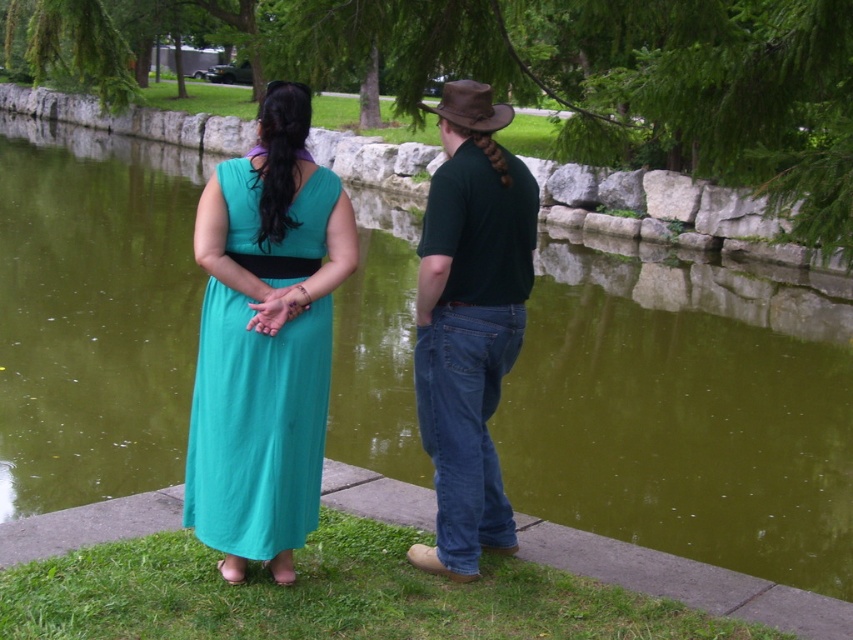
You are a photographer positioned at point (469, 323) in the image. You see the dark green cotton shirt at center. What object is located exactly at your current position?

The dark green cotton shirt at center is located exactly at point (469, 323).

You are a photographer trying to capture a clear shot of the teal fabric dress at center and the brown leather cowboy hat at upper center. Which object is closer to the camera?

A: The teal fabric dress at center is closer to the camera since it is in front of the brown leather cowboy hat at upper center.

You are a photographer trying to capture both the matte green dress at center and the dark green cotton shirt at center in a single frame. Since the camera can only focus on objects of a certain height, which one should you prioritize to ensure it is in focus?

The dark green cotton shirt at center has a greater height compared to the matte green dress at center, so you should prioritize focusing on the dark green cotton shirt at center to ensure it is in focus.